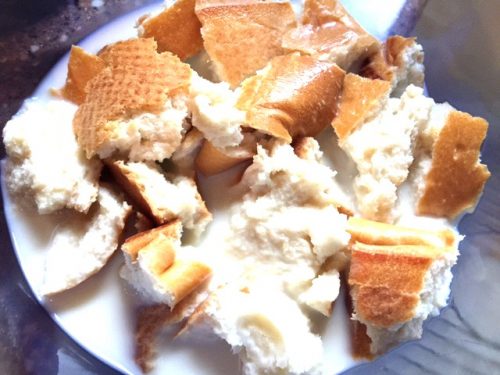
Locate an element on the screen. plate edges is located at coordinates tap(80, 347), tap(13, 248), tap(52, 68), tap(354, 365).